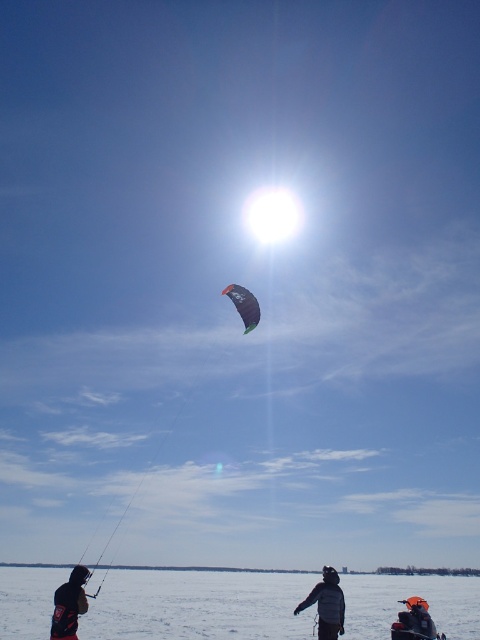
Question: Which point appears farthest from the camera in this image?

Choices:
 (A) (321, 632)
 (B) (238, 296)

Answer: (B)

Question: Based on their relative distances, which object is nearer to the green matte parachute at center?

Choices:
 (A) dark gray jacket at lower left
 (B) dark gray jacket at center

Answer: (B)

Question: Is white snow at lower center in front of dark gray jacket at center?

Choices:
 (A) yes
 (B) no

Answer: (A)

Question: Considering the real-world distances, which object is farthest from the dark gray jacket at center?

Choices:
 (A) dark gray jacket at lower left
 (B) white snow at lower center

Answer: (B)

Question: Can you confirm if dark gray jacket at lower left is thinner than green matte parachute at center?

Choices:
 (A) yes
 (B) no

Answer: (A)

Question: Does white snow at lower center have a smaller size compared to dark gray jacket at center?

Choices:
 (A) no
 (B) yes

Answer: (A)